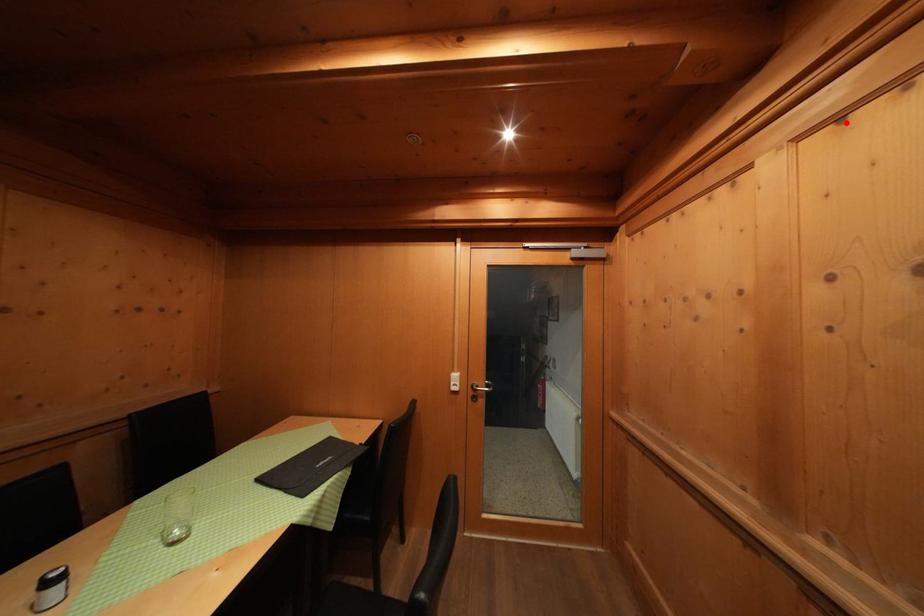
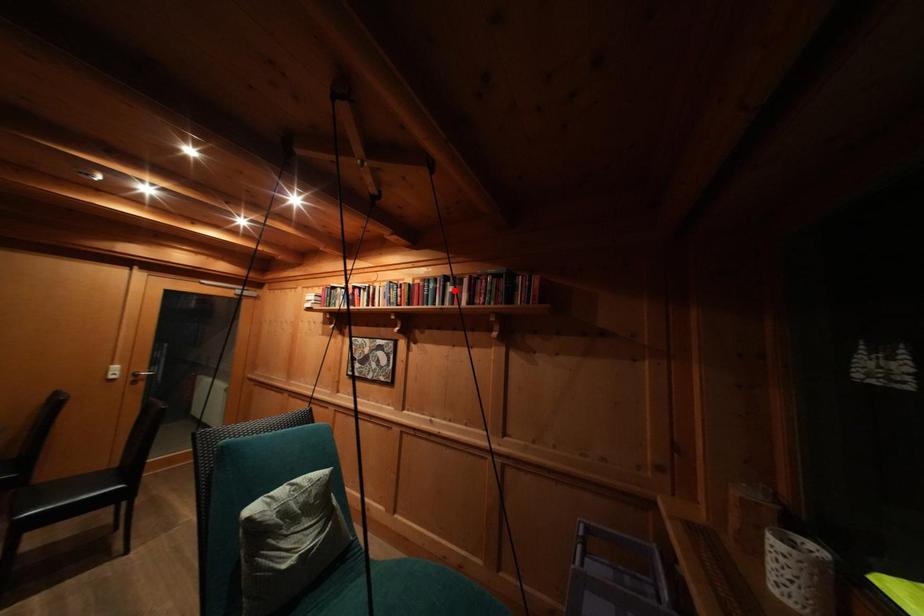
I am providing you with two images of the same scene from different viewpoints. A red point is marked on the first image and another point is marked on the second image. Do the highlighted points in image1 and image2 indicate the same real-world spot?

No